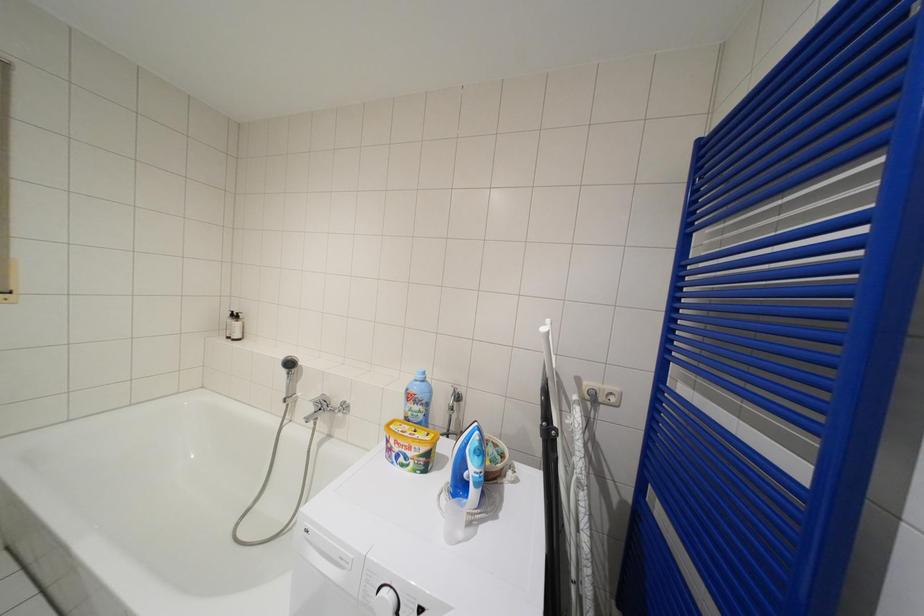
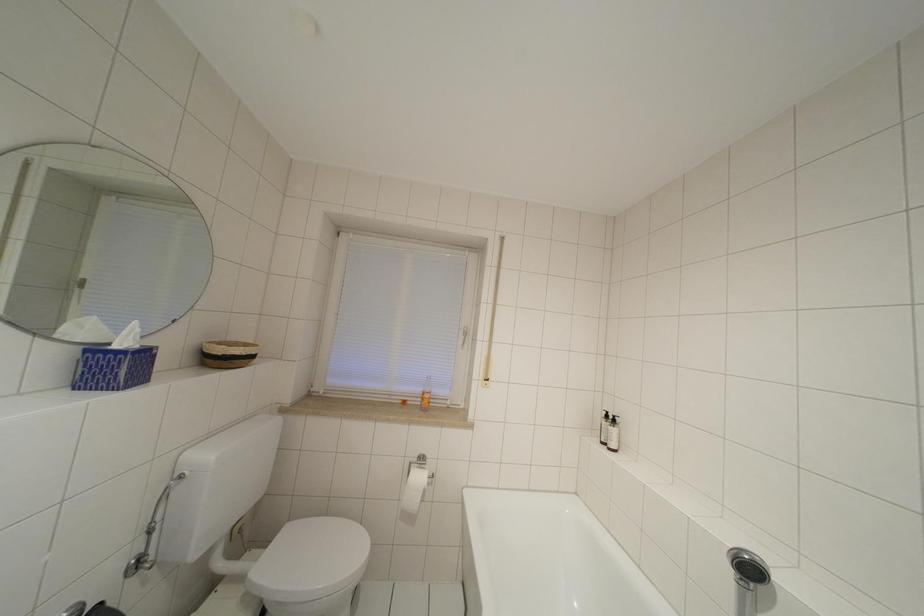
Question: The camera is either moving clockwise (left) or counter-clockwise (right) around the object. The first image is from the beginning of the video and the second image is from the end. Is the camera moving left or right when shooting the video?

Choices:
 (A) Left
 (B) Right

Answer: (B)